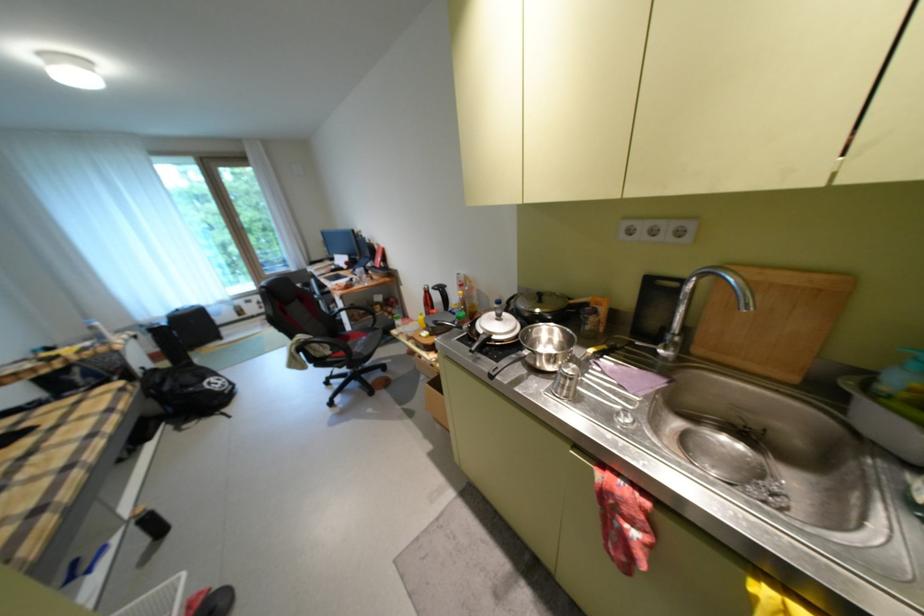
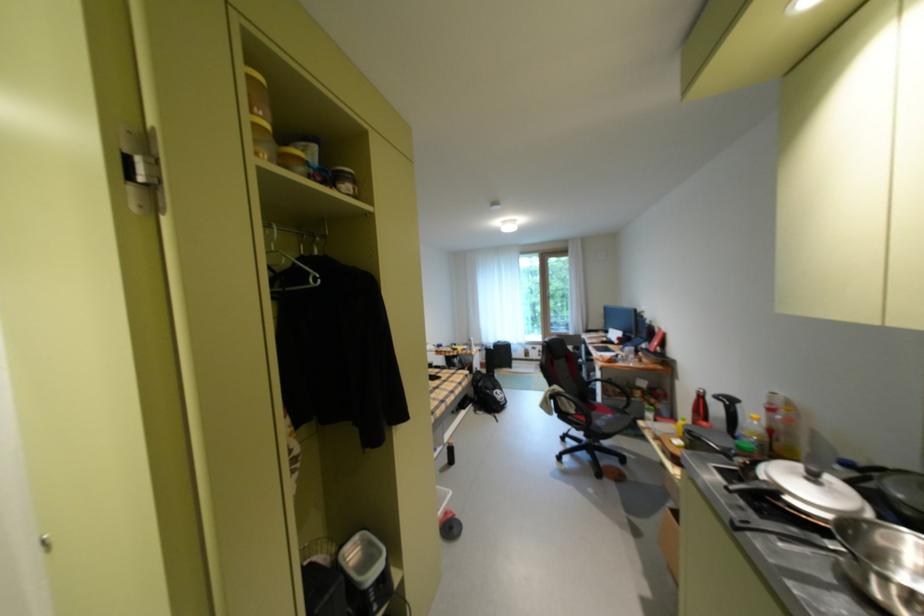
In the second image, find the point that corresponds to (473,308) in the first image.

(766, 439)